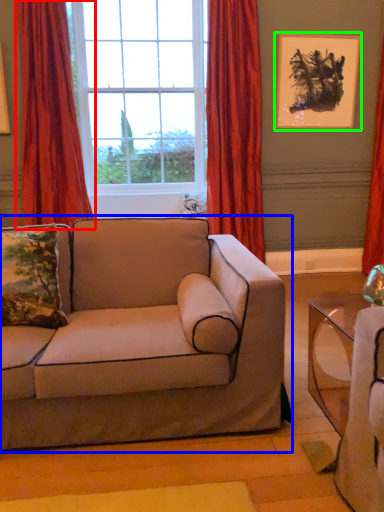
Question: Estimate the real-world distances between objects in this image. Which object is farther from curtain (highlighted by a red box), studio couch (highlighted by a blue box) or picture frame (highlighted by a green box)?

Choices:
 (A) studio couch
 (B) picture frame

Answer: (B)